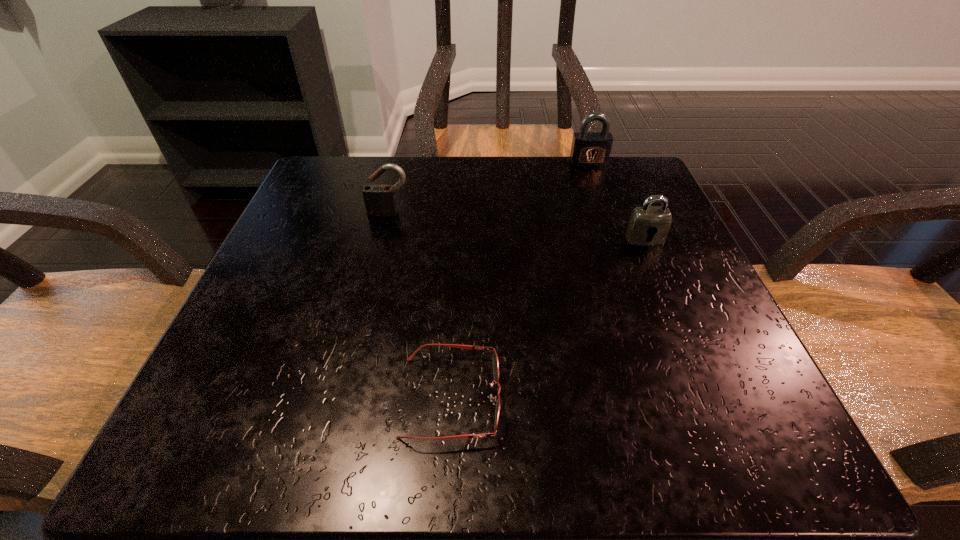
What are the coordinates of `free space between the leftmost object and the farthest object` in the screenshot? It's located at (x=489, y=188).

Find the location of a particular element. The image size is (960, 540). free space between the second nearest object and the farthest padlock is located at coordinates (616, 201).

You are a GUI agent. You are given a task and a screenshot of the screen. Output one action in this format:
    pyautogui.click(x=<x>, y=<y>)
    Task: Click on the free spot between the third nearest object and the nearest padlock
    Image resolution: width=960 pixels, height=540 pixels.
    Given the screenshot: What is the action you would take?
    pyautogui.click(x=516, y=226)

Image resolution: width=960 pixels, height=540 pixels. I want to click on free space between the nearest padlock and the shortest object, so click(548, 318).

At what (x,y) coordinates should I click in order to perform the action: click on free area in between the farthest padlock and the third farthest object. Please return your answer as a coordinate pair (x, y). Looking at the image, I should click on (616, 201).

Locate an element on the screen. free point between the nearest object and the third farthest object is located at coordinates (548, 318).

Image resolution: width=960 pixels, height=540 pixels. I want to click on vacant point located between the second nearest object and the third object from right to left, so click(548, 318).

Find the location of a particular element. The height and width of the screenshot is (540, 960). empty space between the farthest padlock and the leftmost padlock is located at coordinates tap(489, 188).

At what (x,y) coordinates should I click in order to perform the action: click on vacant area that lies between the second object from left to right and the third nearest object. Please return your answer as a coordinate pair (x, y). Looking at the image, I should click on (420, 305).

Locate an element on the screen. This screenshot has height=540, width=960. empty location between the farthest padlock and the third farthest object is located at coordinates (616, 201).